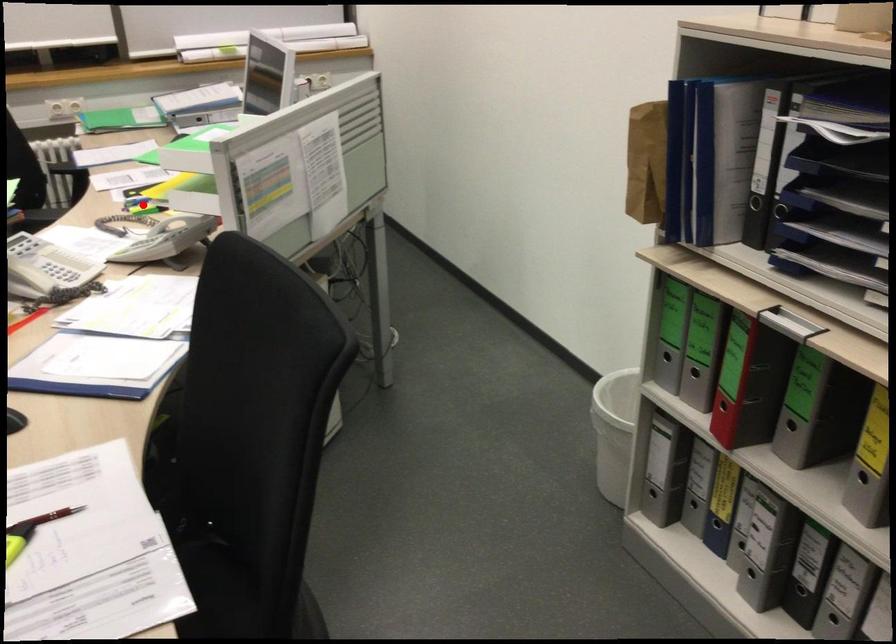
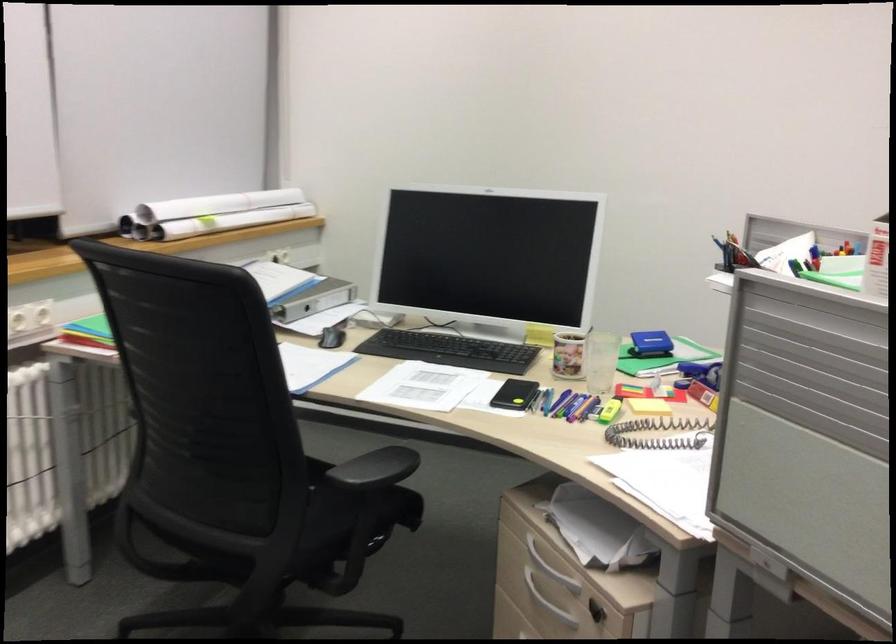
Find the pixel in the second image that matches the highlighted location in the first image.

(565, 404)